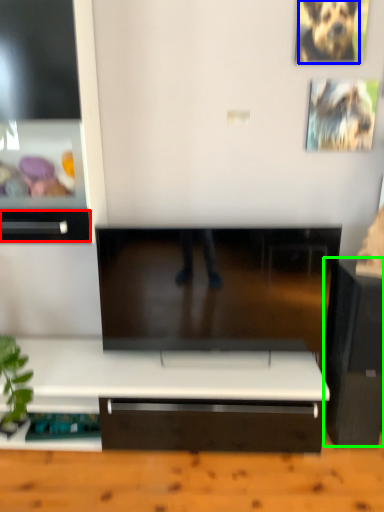
Question: Considering the real-world distances, which object is farthest from drawer (highlighted by a red box)? animal (highlighted by a blue box) or furniture (highlighted by a green box)?

Choices:
 (A) animal
 (B) furniture

Answer: (A)